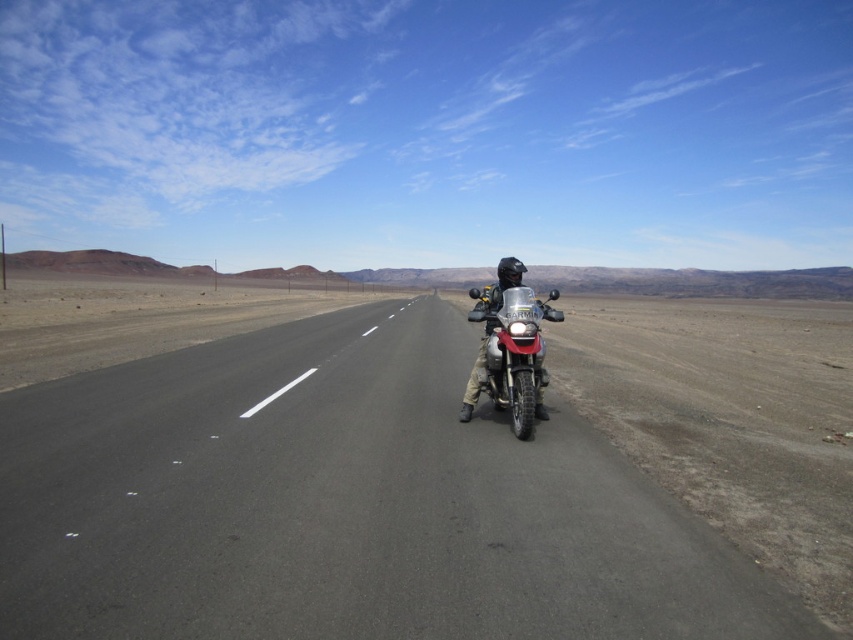
You are a delivery driver planning to take a shortcut through the desert. You have a map that shows a point at coordinates (343,504). According to the scene description, what is located at that point?

The point at coordinates (343,504) marks the asphalt road at center.

You are a drone operator tasked with capturing aerial footage of the asphalt road at center and the metallic silver motorcycle at center. Your drone has a maximum operational range of 5 meters. Can you safely capture footage of both objects without exceeding the drone range?

The distance between the asphalt road at center and the metallic silver motorcycle at center is 4.05 meters, so yes, the drone can safely capture footage of both objects without exceeding its 5 meter range since the distance is within the operational limit.